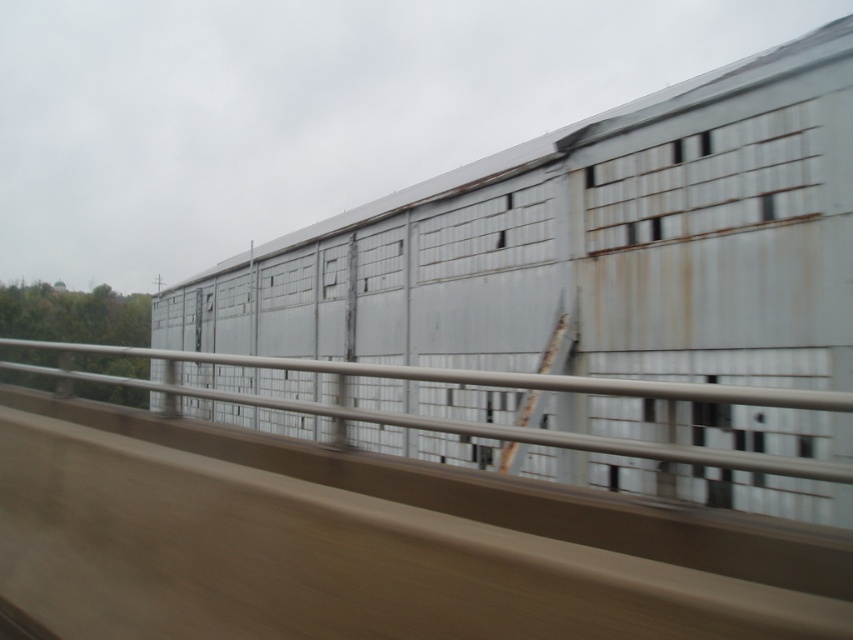
Who is positioned more to the right, rusty metal train at center or satin silver rail at center?

From the viewer's perspective, rusty metal train at center appears more on the right side.

Identify the location of rusty metal train at center. The height and width of the screenshot is (640, 853). (587, 244).

Measure the distance between rusty metal train at center and camera.

A distance of 3.25 meters exists between rusty metal train at center and camera.

Locate an element on the screen. The image size is (853, 640). rusty metal train at center is located at coordinates (587, 244).